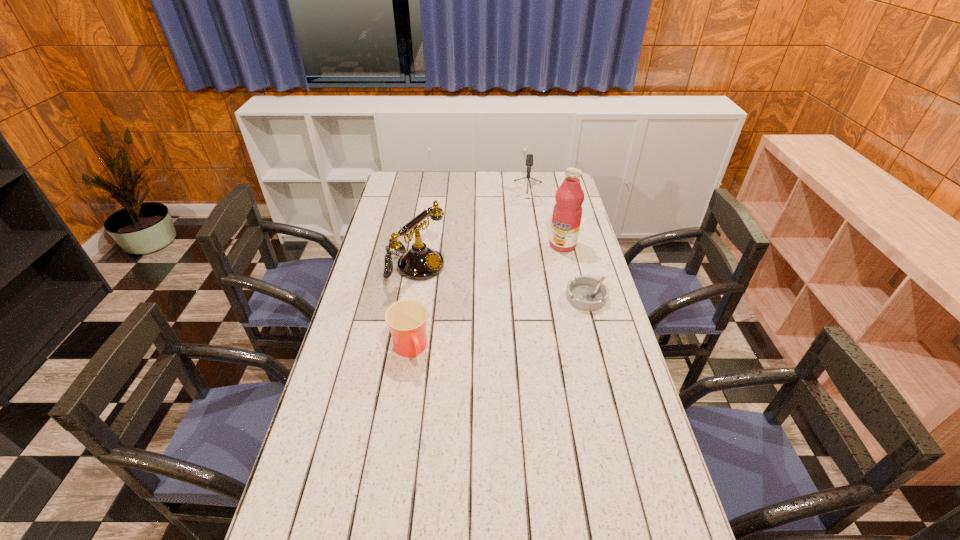
The image size is (960, 540). I want to click on free spot between the shortest object and the tallest object, so click(574, 271).

Where is `free space between the ashtray and the cup`? The image size is (960, 540). free space between the ashtray and the cup is located at coordinates (498, 323).

You are a GUI agent. You are given a task and a screenshot of the screen. Output one action in this format:
    pyautogui.click(x=<x>, y=<y>)
    Task: Click on the free spot between the ashtray and the fruit juice
    
    Given the screenshot: What is the action you would take?
    pyautogui.click(x=574, y=271)

Find the location of a particular element. This screenshot has width=960, height=540. free space that is in between the fruit juice and the telephone is located at coordinates click(489, 256).

This screenshot has width=960, height=540. I want to click on vacant region between the telephone and the tallest object, so click(x=489, y=256).

Where is `object that is the fourth closest to the microphone`? object that is the fourth closest to the microphone is located at coordinates (406, 319).

Locate which object is the closest to the ashtray. Please provide its 2D coordinates. Your answer should be formatted as a tuple, i.e. [(x, y)], where the tuple contains the x and y coordinates of a point satisfying the conditions above.

[(567, 212)]

This screenshot has width=960, height=540. What are the coordinates of `vacant space that satisfies the following two spatial constraints: 1. on the back side of the farthest object; 2. on the right side of the telephone` in the screenshot? It's located at (427, 193).

Locate an element on the screen. vacant area in the image that satisfies the following two spatial constraints: 1. on the front side of the farthest object; 2. on the right side of the fruit juice is located at coordinates (534, 245).

Find the location of a particular element. vacant space that satisfies the following two spatial constraints: 1. on the front side of the tallest object; 2. on the right side of the ashtray is located at coordinates (575, 298).